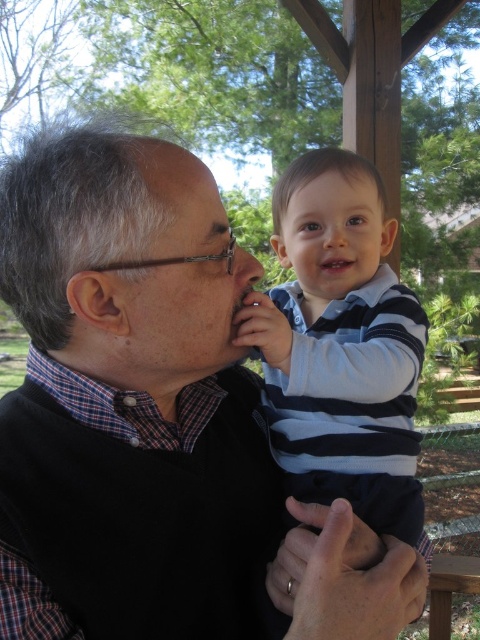
Question: Which object is the closest to the matte skin forehead at upper center?

Choices:
 (A) black sweater at center
 (B) smooth skin baby at center
 (C) matte black face at center

Answer: (B)

Question: Which point is closer to the camera?

Choices:
 (A) black sweater at center
 (B) striped cotton shirt at center

Answer: (A)

Question: Observing the image, what is the correct spatial positioning of matte black face at center in reference to smooth skin baby at center?

Choices:
 (A) left
 (B) right

Answer: (A)

Question: Is matte black face at center in front of matte skin forehead at upper center?

Choices:
 (A) no
 (B) yes

Answer: (B)

Question: Which point is closer to the camera?

Choices:
 (A) (277, 212)
 (B) (203, 296)
 (C) (333, 449)

Answer: (B)

Question: Can you confirm if striped cotton shirt at center is positioned to the left of matte skin forehead at upper center?

Choices:
 (A) no
 (B) yes

Answer: (A)